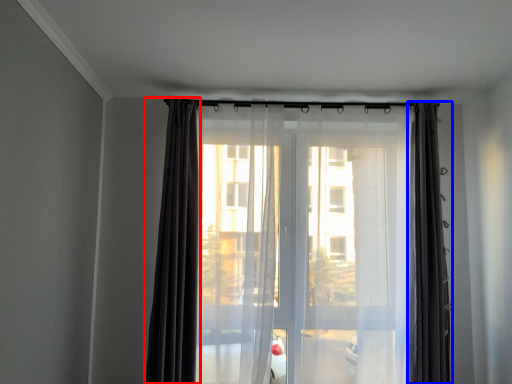
Question: Which object appears farthest to the camera in this image, curtain (highlighted by a red box) or curtain (highlighted by a blue box)?

Choices:
 (A) curtain
 (B) curtain

Answer: (B)